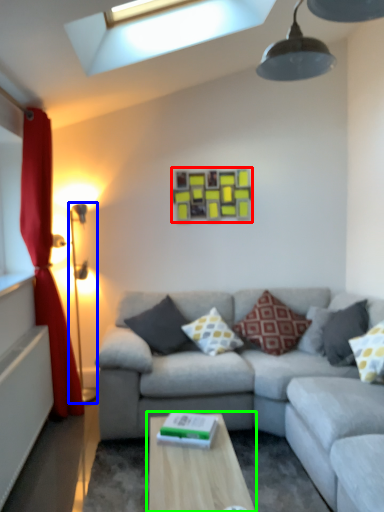
Question: Which is nearer to the picture frame (highlighted by a red box)? table lamp (highlighted by a blue box) or table (highlighted by a green box).

Choices:
 (A) table lamp
 (B) table

Answer: (A)